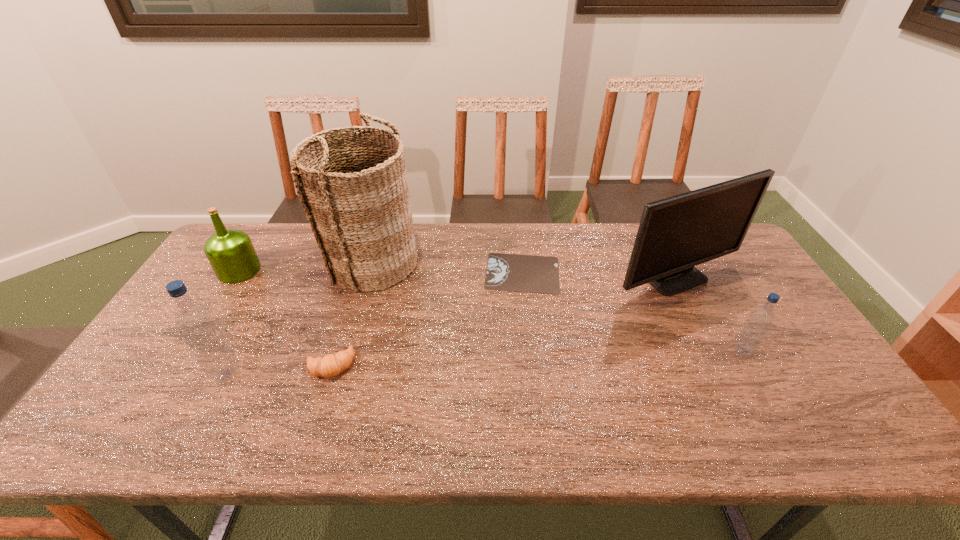
Identify the location of the taller water bottle. This screenshot has width=960, height=540. (196, 323).

The height and width of the screenshot is (540, 960). I want to click on the second object from left to right, so click(x=196, y=323).

Where is `the farther water bottle`? the farther water bottle is located at coordinates (760, 320).

The width and height of the screenshot is (960, 540). I want to click on the right water bottle, so click(x=760, y=320).

The image size is (960, 540). Find the location of `the fifth object from left to right`. the fifth object from left to right is located at coordinates (505, 272).

Where is `mousepad`? mousepad is located at coordinates (505, 272).

At what (x,y) coordinates should I click in order to perform the action: click on the tallest object. Please return your answer as a coordinate pair (x, y). Looking at the image, I should click on (358, 204).

Identify the location of computer monitor. coord(675,234).

The height and width of the screenshot is (540, 960). In order to click on the sixth tallest object in this screenshot , I will do `click(330, 365)`.

This screenshot has width=960, height=540. In order to click on olive oil in this screenshot , I will do `click(230, 252)`.